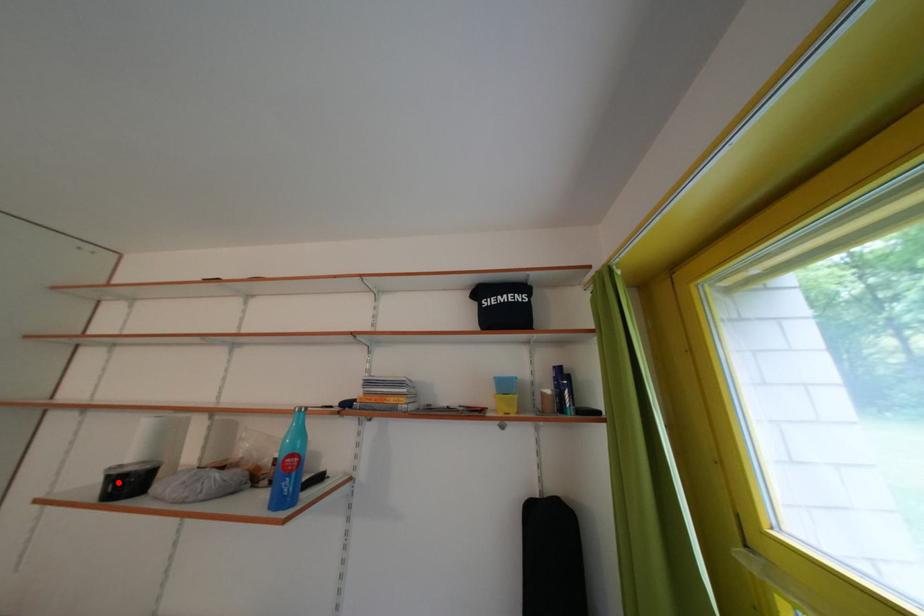
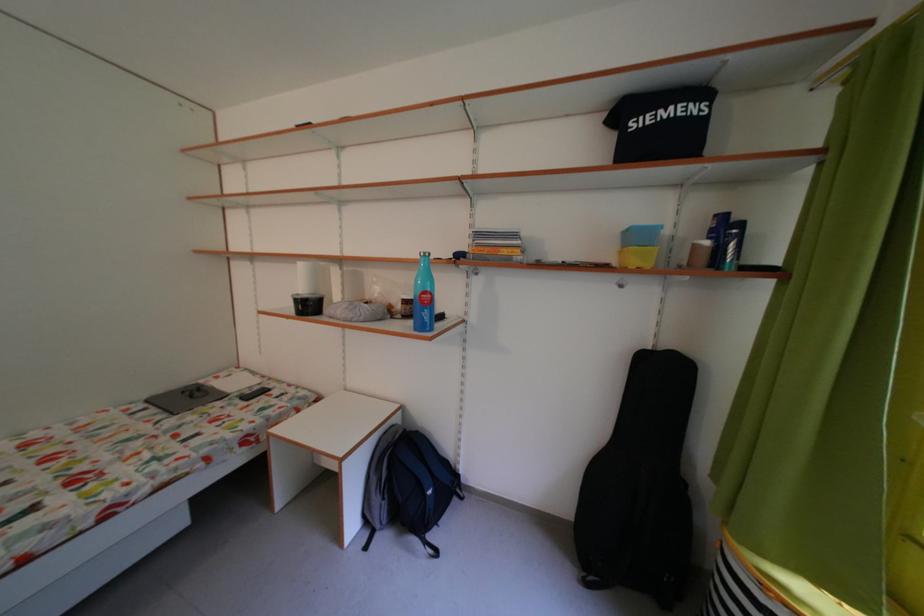
Question: I am providing you with two images of the same scene from different viewpoints. Image1 has a red point marked. In image2, the corresponding 3D location appears at what relative position? Reply with the corresponding letter.

Choices:
 (A) Closer
 (B) Farther

Answer: (B)